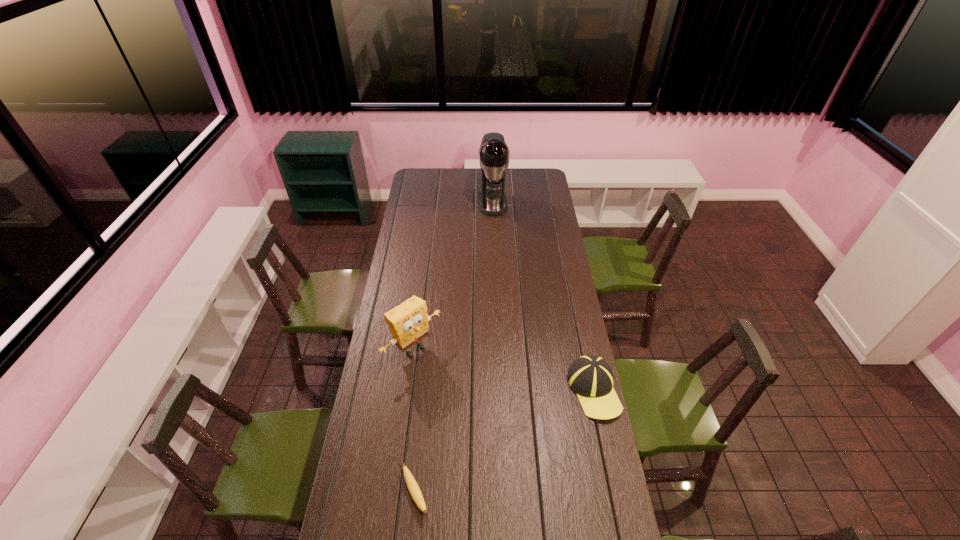
The width and height of the screenshot is (960, 540). Identify the location of free space located 0.140m on the face of the third shortest object. (453, 386).

Locate an element on the screen. This screenshot has width=960, height=540. vacant space located on the face of the third shortest object is located at coordinates (460, 392).

This screenshot has width=960, height=540. Find the location of `free space located 0.380m place cup under the spout of the coffee maker`. free space located 0.380m place cup under the spout of the coffee maker is located at coordinates (499, 260).

Locate an element on the screen. vacant space located place cup under the spout of the coffee maker is located at coordinates (499, 261).

Where is `free space located place cup under the spout of the coffee maker`? free space located place cup under the spout of the coffee maker is located at coordinates (495, 232).

At what (x,y) coordinates should I click in order to perform the action: click on object present at the near edge. Please return your answer as a coordinate pair (x, y). Looking at the image, I should click on (412, 485).

What are the coordinates of `object positioned at the left edge` in the screenshot? It's located at (408, 322).

Where is `object located at the right edge`? object located at the right edge is located at coordinates (590, 377).

Where is `vacant space at the left edge`? The image size is (960, 540). vacant space at the left edge is located at coordinates (x=405, y=385).

In order to click on vacant region at the right edge of the desktop in this screenshot , I will do `click(535, 197)`.